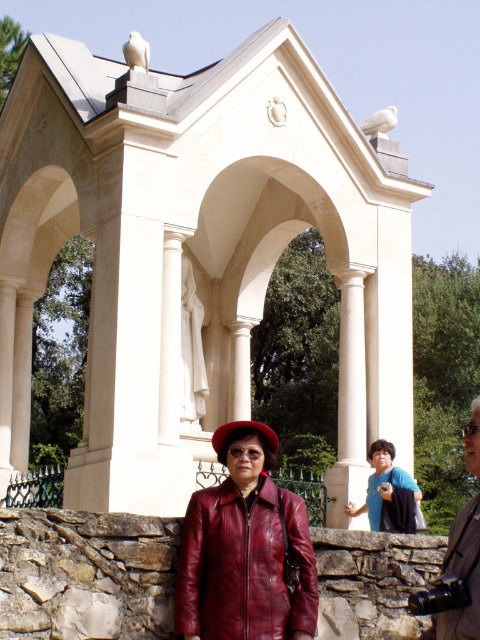
Question: Among these objects, which one is nearest to the camera?

Choices:
 (A) leather jacket at center
 (B) red leather hat at center
 (C) blue fabric bag at center

Answer: (A)

Question: Can you confirm if leather jacket at center is positioned to the left of dark brown leather jacket at lower right?

Choices:
 (A) no
 (B) yes

Answer: (B)

Question: Can you confirm if white stone gazebo at center is positioned above leather jacket at center?

Choices:
 (A) no
 (B) yes

Answer: (B)

Question: Which point is farther from the camera taking this photo?

Choices:
 (A) (356, 504)
 (B) (239, 428)

Answer: (A)

Question: Does white stone gazebo at center have a lesser width compared to leather jacket at center?

Choices:
 (A) yes
 (B) no

Answer: (B)

Question: Which of these objects is positioned closest to the dark brown leather jacket at lower right?

Choices:
 (A) white stone gazebo at center
 (B) leather jacket at center

Answer: (B)